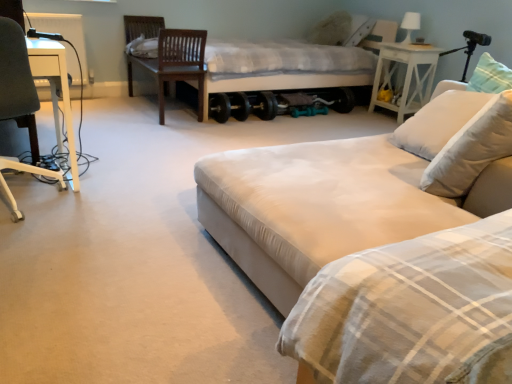
This screenshot has width=512, height=384. In order to click on white glossy table lamp at upper right in this screenshot , I will do `click(410, 25)`.

What do you see at coordinates (410, 25) in the screenshot? I see `white glossy table lamp at upper right` at bounding box center [410, 25].

What is the approximate height of white plastic radiator at upper left?

27.21 inches.

I want to click on white plastic radiator at upper left, so click(x=64, y=32).

The height and width of the screenshot is (384, 512). I want to click on white fabric bed at center, marked as the first bed in a bottom-to-top arrangement, so click(x=361, y=187).

What do you see at coordinates (361, 187) in the screenshot? The height and width of the screenshot is (384, 512). I see `white fabric bed at center, which is the 2th bed in back-to-front order` at bounding box center [361, 187].

Identify the location of white soft pillow at right. (471, 149).

Identify the location of white plastic chair at left. This screenshot has height=384, width=512. (15, 74).

Can you confirm if white plastic radiator at upper left is bigger than white fabric bed at center, which is the 2th bed in back-to-front order?

No.

From the image's perspective, which one is positioned higher, white plastic radiator at upper left or white fabric bed at center, marked as the first bed in a bottom-to-top arrangement?

white plastic radiator at upper left appears higher in the image.

Based on the photo, is white plastic radiator at upper left positioned far away from white fabric bed at center, which is the 2th bed in back-to-front order?

Yes, white plastic radiator at upper left and white fabric bed at center, which is the 2th bed in back-to-front order, are located far from each other.

In the image, is white plastic radiator at upper left positioned in front of or behind white fabric bed at center, marked as the 2th bed in a top-to-bottom arrangement?

white plastic radiator at upper left is positioned farther from the viewer than white fabric bed at center, marked as the 2th bed in a top-to-bottom arrangement.

From the image's perspective, which is above, white soft pillow at right or white glossy table lamp at upper right?

white glossy table lamp at upper right is shown above in the image.

How different are the orientations of white soft pillow at right and white glossy table lamp at upper right in degrees?

90.1 degrees.

Is white soft pillow at right placed right next to white glossy table lamp at upper right?

There is a gap between white soft pillow at right and white glossy table lamp at upper right.

Do you think white soft pillow at right is within white glossy table lamp at upper right, or outside of it?

white soft pillow at right is spatially situated outside white glossy table lamp at upper right.

Considering the relative sizes of white wood side table at right and white soft pillow at right in the image provided, is white wood side table at right taller than white soft pillow at right?

Correct, white wood side table at right is much taller as white soft pillow at right.

How many degrees apart are the facing directions of white wood side table at right and white soft pillow at right?

87.5 degrees.

Does point (374, 91) come closer to viewer compared to point (483, 161)?

No, (374, 91) is further to viewer.

Is white wood side table at right looking in the opposite direction of white soft pillow at right?

white wood side table at right does not have its back to white soft pillow at right.

Which of these two, white wood side table at right or white fabric bed at center, which ranks as the 1th bed in back-to-front order, stands taller?

white fabric bed at center, which ranks as the 1th bed in back-to-front order.

Would you say white wood side table at right is outside white fabric bed at center, which is counted as the first bed, starting from the top?

Yes, white wood side table at right is outside of white fabric bed at center, which is counted as the first bed, starting from the top.

From the image's perspective, between white wood side table at right and white fabric bed at center, which is the 2th bed in bottom-to-top order, who is located below?

From the image's view, white wood side table at right is below.

In the scene shown: From a real-world perspective, relative to white fabric bed at center, which is counted as the first bed, starting from the top, is white wood side table at right vertically above or below?

From a real-world perspective, white wood side table at right is physically below white fabric bed at center, which is counted as the first bed, starting from the top.

Which of these two, dark brown wood swivel chair at upper left or white plastic radiator at upper left, stands taller?

dark brown wood swivel chair at upper left is taller.

Considering their positions, is dark brown wood swivel chair at upper left located in front of or behind white plastic radiator at upper left?

Visually, dark brown wood swivel chair at upper left is located in front of white plastic radiator at upper left.

Is dark brown wood swivel chair at upper left at the left side of white plastic radiator at upper left?

In fact, dark brown wood swivel chair at upper left is to the right of white plastic radiator at upper left.

In the image, there is a dark brown wood swivel chair at upper left. What are the coordinates of `radiator above it (from the image's perspective)` in the screenshot? It's located at (64, 32).

How far apart are white wood side table at right and white plastic radiator at upper left?

The distance of white wood side table at right from white plastic radiator at upper left is 3.01 meters.

Can you confirm if white wood side table at right is thinner than white plastic radiator at upper left?

In fact, white wood side table at right might be wider than white plastic radiator at upper left.

Is white wood side table at right taller than white plastic radiator at upper left?

In fact, white wood side table at right may be shorter than white plastic radiator at upper left.

Consider the image. Which is less distant, (237, 99) or (507, 104)?

Point (237, 99) appears to be farther away from the viewer than point (507, 104).

Who is smaller, white fabric bed at center, which ranks as the 1th bed in back-to-front order, or white soft pillow at right?

white soft pillow at right.

From the image's perspective, between white fabric bed at center, the second bed from the front, and white soft pillow at right, who is located below?

white soft pillow at right.

In order to click on bed that is under the white plastic radiator at upper left (from a real-world perspective) in this screenshot , I will do `click(361, 187)`.

Image resolution: width=512 pixels, height=384 pixels. What are the coordinates of `pillow below the white glossy table lamp at upper right (from the image's perspective)` in the screenshot? It's located at (471, 149).

From the image, which object appears to be farther from dark brown wood swivel chair at upper left, white plastic chair at left or white wood side table at right?

white wood side table at right is further to dark brown wood swivel chair at upper left.

From the image, which object appears to be nearer to white glossy table lamp at upper right, white soft pillow at right or white fabric bed at center, which ranks as the 1th bed in back-to-front order?

white fabric bed at center, which ranks as the 1th bed in back-to-front order, is positioned closer to the anchor white glossy table lamp at upper right.

Looking at the image, which one is located further to white soft pillow at right, dark brown wood swivel chair at upper left or white glossy table lamp at upper right?

Result: The object further to white soft pillow at right is white glossy table lamp at upper right.

Based on their spatial positions, is white fabric bed at center, the second bed from the front, or white soft pillow at right further from white plastic radiator at upper left?

Based on the image, white soft pillow at right appears to be further to white plastic radiator at upper left.

From the image, which object appears to be farther from white fabric bed at center, placed as the 1th bed when sorted from front to back, white plastic chair at left or white wood side table at right?

Based on the image, white wood side table at right appears to be further to white fabric bed at center, placed as the 1th bed when sorted from front to back.

Looking at the image, which one is located closer to white fabric bed at center, the second bed from the front, dark brown wood swivel chair at upper left or white wood side table at right?

white wood side table at right is positioned closer to the anchor white fabric bed at center, the second bed from the front.

Consider the image. Considering their positions, is white plastic radiator at upper left positioned closer to dark brown wood swivel chair at upper left than white plastic chair at left?

The object closer to dark brown wood swivel chair at upper left is white plastic radiator at upper left.

Consider the image. Considering their positions, is white fabric bed at center, the second bed from the front, positioned further to dark brown wood swivel chair at upper left than white plastic chair at left?

white plastic chair at left is positioned further to the anchor dark brown wood swivel chair at upper left.

At what (x,y) coordinates should I click in order to perform the action: click on swivel chair between white plastic chair at left and white fabric bed at center, which is the 2th bed in bottom-to-top order, along the z-axis. Please return your answer as a coordinate pair (x, y). Looking at the image, I should click on (169, 56).

The image size is (512, 384). What are the coordinates of `nightstand between white plastic chair at left and white glossy table lamp at upper right from left to right` in the screenshot? It's located at (405, 75).

Identify the location of pillow between white fabric bed at center, placed as the 1th bed when sorted from front to back, and white wood side table at right in the front-back direction. (471, 149).

You are a GUI agent. You are given a task and a screenshot of the screen. Output one action in this format:
    pyautogui.click(x=<x>, y=<y>)
    Task: Click on the pillow between white plastic radiator at upper left and white wood side table at right
    Image resolution: width=512 pixels, height=384 pixels.
    Given the screenshot: What is the action you would take?
    pyautogui.click(x=471, y=149)